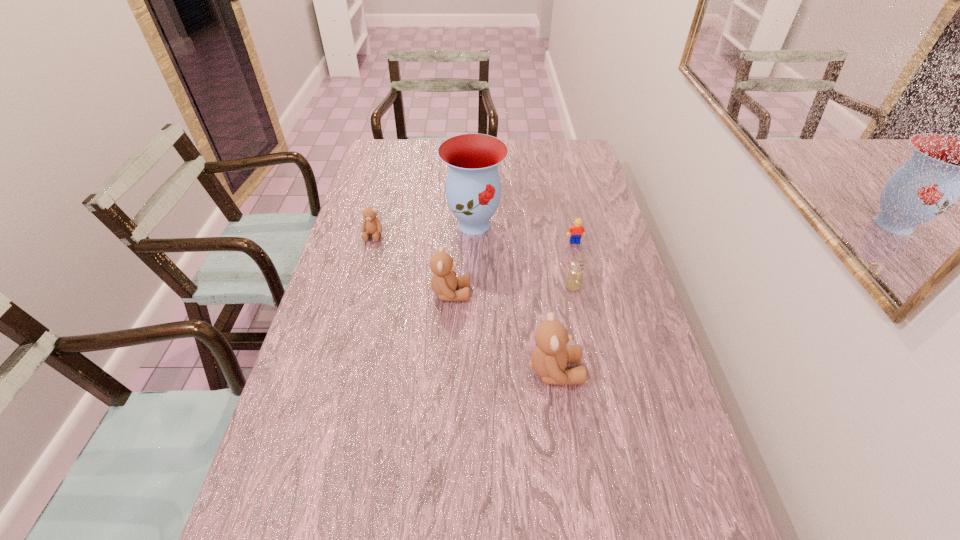
Image resolution: width=960 pixels, height=540 pixels. What are the coordinates of `vacant region between the vase and the Lego` in the screenshot? It's located at (524, 233).

You are a GUI agent. You are given a task and a screenshot of the screen. Output one action in this format:
    pyautogui.click(x=<x>, y=<y>)
    Task: Click on the vacant space that's between the fourth shortest object and the Lego
    Image resolution: width=960 pixels, height=540 pixels.
    Given the screenshot: What is the action you would take?
    pyautogui.click(x=513, y=267)

Identify which object is the nearest to the shortest teddy bear. Please provide its 2D coordinates. Your answer should be formatted as a tuple, i.e. [(x, y)], where the tuple contains the x and y coordinates of a point satisfying the conditions above.

[(473, 188)]

Locate which object is the second closest to the nearest object. Please provide its 2D coordinates. Your answer should be formatted as a tuple, i.e. [(x, y)], where the tuple contains the x and y coordinates of a point satisfying the conditions above.

[(444, 282)]

The image size is (960, 540). Identify the location of teddy bear object that ranks as the third closest to the saltshaker. (371, 225).

Choose which teddy bear is the nearest neighbor to the second tallest teddy bear. Please provide its 2D coordinates. Your answer should be formatted as a tuple, i.e. [(x, y)], where the tuple contains the x and y coordinates of a point satisfying the conditions above.

[(549, 359)]

Identify the location of vacant area in the image that satisfies the following two spatial constraints: 1. on the face of the Lego; 2. on the front-facing side of the second teddy bear from left to right. This screenshot has height=540, width=960. (587, 293).

I want to click on free spot that satisfies the following two spatial constraints: 1. on the face of the Lego; 2. on the front-facing side of the second nearest teddy bear, so click(x=587, y=293).